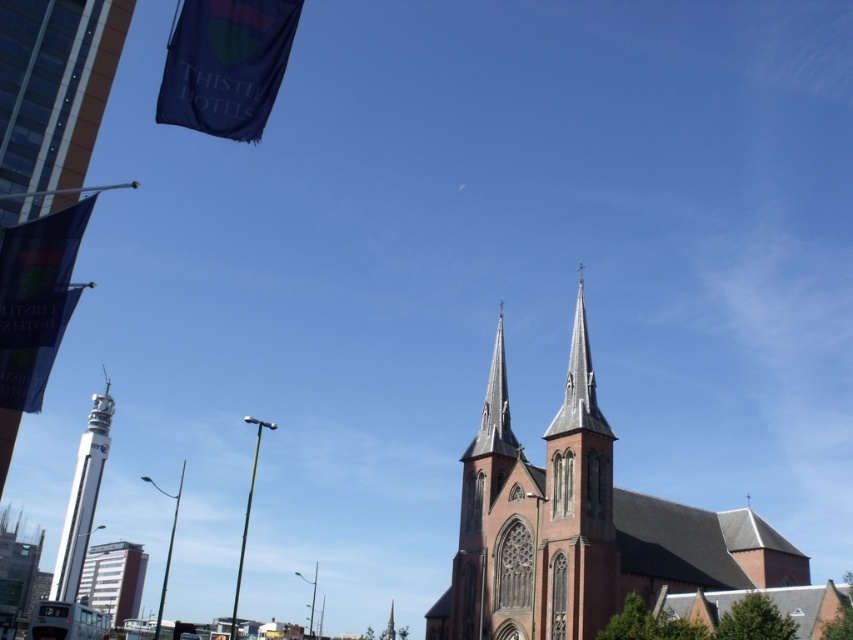
Between point (607, 556) and point (80, 452), which one is positioned behind?

Point (80, 452)

Who is more forward, (x=605, y=476) or (x=91, y=500)?

Positioned in front is point (x=605, y=476).

This screenshot has height=640, width=853. What are the coordinates of `red brick church steeple at center` in the screenshot? It's located at click(579, 502).

From the picture: Which of these two, red brick church at center or red brick tower at lower left, stands shorter?

red brick tower at lower left

Between point (511, 490) and point (103, 609), which one is positioned in front?

Point (511, 490) is more forward.

Which is behind, point (584, 621) or point (106, 573)?

Positioned behind is point (106, 573).

This screenshot has height=640, width=853. What are the coordinates of `red brick church at center` in the screenshot? It's located at (595, 532).

How much distance is there between red brick church at center and metallic silver bus at lower left?

red brick church at center is 56.34 meters from metallic silver bus at lower left.

Does red brick church at center have a lesser width compared to metallic silver bus at lower left?

No.

Between point (694, 577) and point (86, 611), which one is positioned in front?

Point (694, 577)

The width and height of the screenshot is (853, 640). Find the location of `red brick church at center`. red brick church at center is located at coordinates (595, 532).